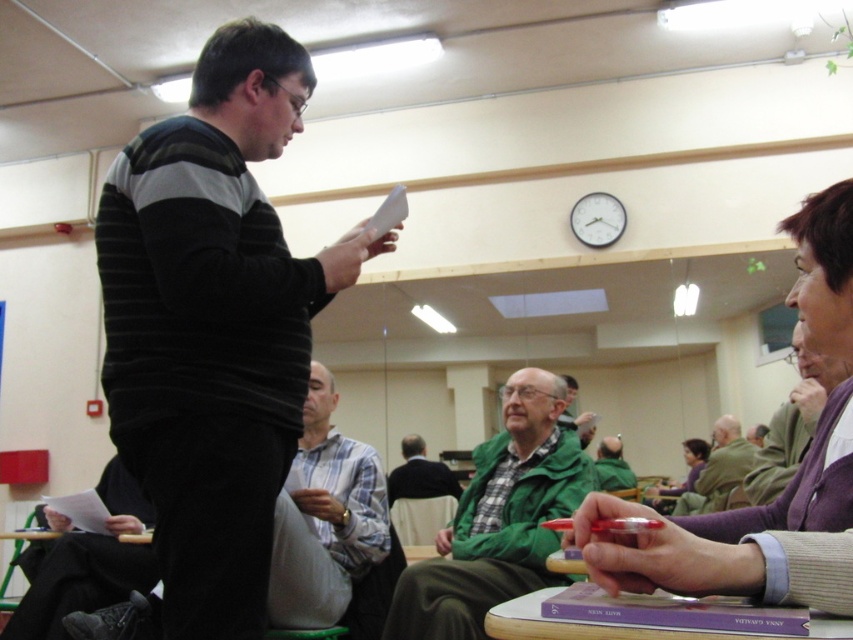
Is point (490, 490) farther from camera compared to point (734, 428)?

No.

Can you confirm if green matte jacket at center is positioned below green textured jacket at center?

Incorrect, green matte jacket at center is not positioned below green textured jacket at center.

Based on the photo, who is more forward, [492,461] or [753,445]?

Positioned in front is point [492,461].

This screenshot has height=640, width=853. What are the coordinates of `green matte jacket at center` in the screenshot? It's located at click(498, 518).

Who is higher up, white plaid shirt at center or green textured jacket at center?

white plaid shirt at center

Does point (273, 529) come farther from viewer compared to point (709, 452)?

That is False.

Where is `white plaid shirt at center`? white plaid shirt at center is located at coordinates (325, 518).

Who is lower down, striped sweater at center or green matte jacket at center?

Positioned lower is green matte jacket at center.

Between striped sweater at center and green matte jacket at center, which one has more height?

With more height is striped sweater at center.

This screenshot has width=853, height=640. I want to click on striped sweater at center, so click(x=213, y=324).